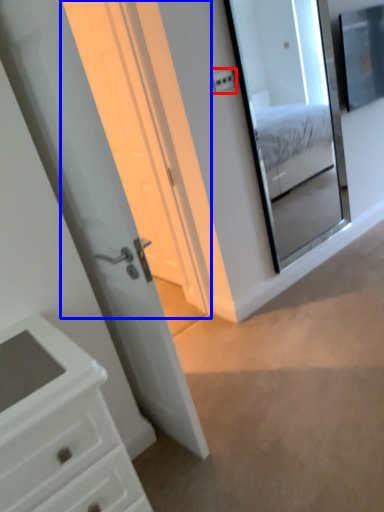
Question: Which object appears farthest to the camera in this image, light switch (highlighted by a red box) or screen door (highlighted by a blue box)?

Choices:
 (A) light switch
 (B) screen door

Answer: (A)